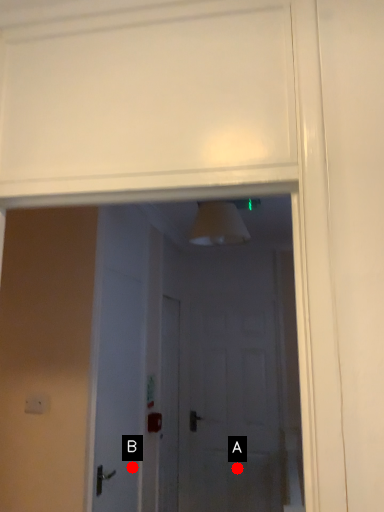
Question: Two points are circled on the image, labeled by A and B beside each circle. Which point appears closest to the camera in this image?

Choices:
 (A) A is closer
 (B) B is closer

Answer: (B)